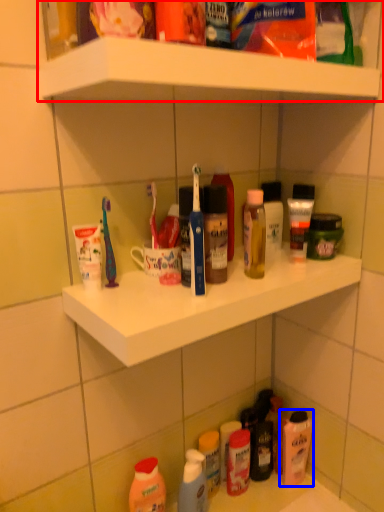
Question: Which object appears farthest to the camera in this image, shelf (highlighted by a red box) or cleaning product (highlighted by a blue box)?

Choices:
 (A) shelf
 (B) cleaning product

Answer: (B)